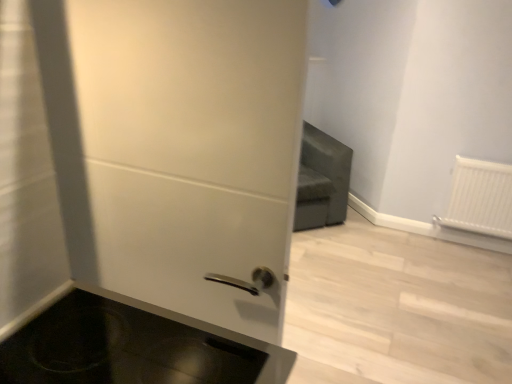
Question: Should I look upward or downward to see white plastic radiator at right?

Choices:
 (A) down
 (B) up

Answer: (A)

Question: From a real-world perspective, does black glass cooktop at lower left sit lower than white plastic radiator at right?

Choices:
 (A) no
 (B) yes

Answer: (A)

Question: Is black glass cooktop at lower left turned away from white plastic radiator at right?

Choices:
 (A) no
 (B) yes

Answer: (A)

Question: Considering the relative positions of black glass cooktop at lower left and white plastic radiator at right in the image provided, is black glass cooktop at lower left to the right of white plastic radiator at right from the viewer's perspective?

Choices:
 (A) yes
 (B) no

Answer: (B)

Question: Can you confirm if black glass cooktop at lower left is smaller than white plastic radiator at right?

Choices:
 (A) no
 (B) yes

Answer: (B)

Question: Can you confirm if black glass cooktop at lower left is bigger than white plastic radiator at right?

Choices:
 (A) no
 (B) yes

Answer: (A)

Question: From the image's perspective, does black glass cooktop at lower left appear higher than white plastic radiator at right?

Choices:
 (A) no
 (B) yes

Answer: (A)

Question: Can you confirm if white plastic radiator at right is bigger than black glass cooktop at lower left?

Choices:
 (A) no
 (B) yes

Answer: (B)

Question: From the image's perspective, is white plastic radiator at right below black glass cooktop at lower left?

Choices:
 (A) no
 (B) yes

Answer: (A)

Question: Considering the relative sizes of white plastic radiator at right and black glass cooktop at lower left in the image provided, is white plastic radiator at right taller than black glass cooktop at lower left?

Choices:
 (A) yes
 (B) no

Answer: (A)

Question: Is white plastic radiator at right at the right side of black glass cooktop at lower left?

Choices:
 (A) yes
 (B) no

Answer: (A)

Question: Does white plastic radiator at right have a smaller size compared to black glass cooktop at lower left?

Choices:
 (A) yes
 (B) no

Answer: (B)

Question: From a real-world perspective, is white plastic radiator at right beneath black glass cooktop at lower left?

Choices:
 (A) yes
 (B) no

Answer: (A)

Question: From a real-world perspective, is black glass cooktop at lower left under white matte door at center?

Choices:
 (A) yes
 (B) no

Answer: (A)